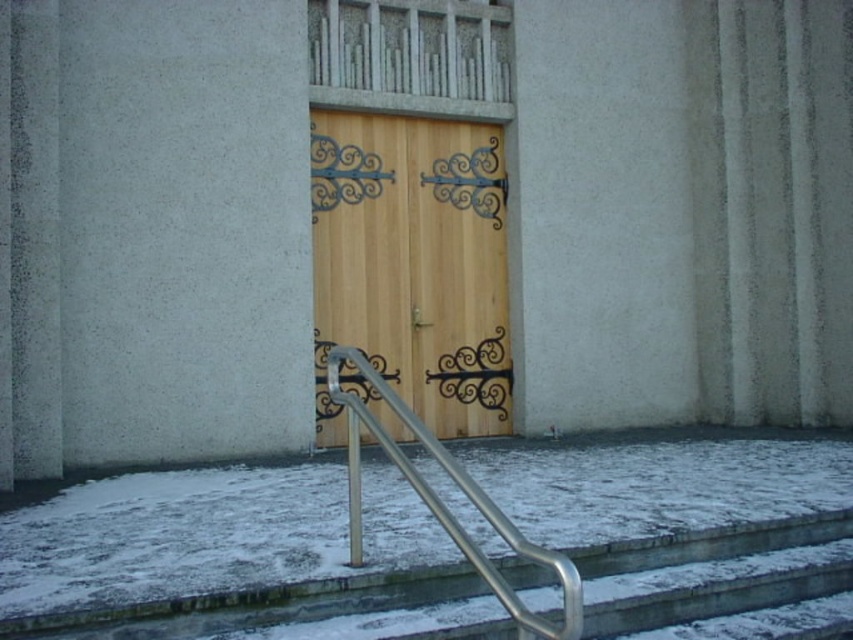
Question: Which object is farther from the camera taking this photo?

Choices:
 (A) wooden door at center
 (B) white powdery snow at lower center
 (C) silver metallic handrail at lower center

Answer: (A)

Question: Is white powdery snow at lower center smaller than wooden door at center?

Choices:
 (A) yes
 (B) no

Answer: (A)

Question: Which point is closer to the camera taking this photo?

Choices:
 (A) (451, 529)
 (B) (432, 140)
 (C) (137, 632)

Answer: (A)

Question: Which is farther from the wooden door at center?

Choices:
 (A) silver metallic handrail at lower center
 (B) white powdery snow at lower center

Answer: (A)

Question: Is white powdery snow at lower center to the left of silver metallic handrail at lower center from the viewer's perspective?

Choices:
 (A) no
 (B) yes

Answer: (A)

Question: Does white powdery snow at lower center have a larger size compared to wooden door at center?

Choices:
 (A) yes
 (B) no

Answer: (B)